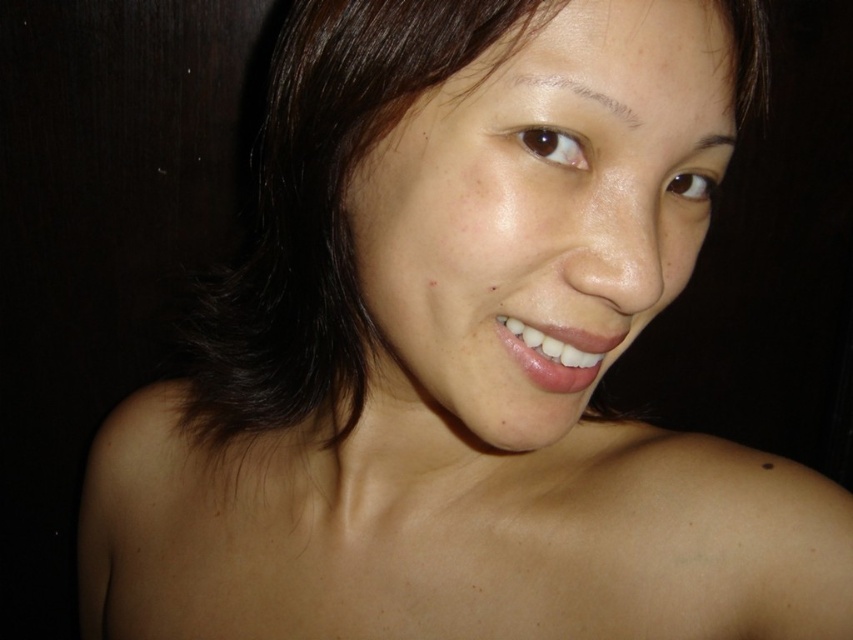
At what (x,y) coordinates should I click in order to perform the action: click on smooth skin face at center. Please return your answer as a coordinate pair (x, y). Image resolution: width=853 pixels, height=640 pixels. Looking at the image, I should click on (538, 214).

The height and width of the screenshot is (640, 853). I want to click on smooth skin face at center, so click(x=538, y=214).

Where is `smooth skin face at center`? Image resolution: width=853 pixels, height=640 pixels. smooth skin face at center is located at coordinates (538, 214).

Is dark brown hair at upper center to the left of dark brown hair at upper right from the viewer's perspective?

Yes, dark brown hair at upper center is to the left of dark brown hair at upper right.

Between dark brown hair at upper center and dark brown hair at upper right, which one is positioned higher?

dark brown hair at upper center is above.

Is point (579, 113) more distant than point (727, 136)?

No.

Find the location of `dark brown hair at upper center`. dark brown hair at upper center is located at coordinates (577, 93).

Does point (523, 275) lie in front of point (706, 134)?

Yes, point (523, 275) is closer to viewer.

Who is more distant from viewer, (491, 145) or (720, 145)?

The point (720, 145) is behind.

Where is `smooth skin face at center`? This screenshot has width=853, height=640. smooth skin face at center is located at coordinates (538, 214).